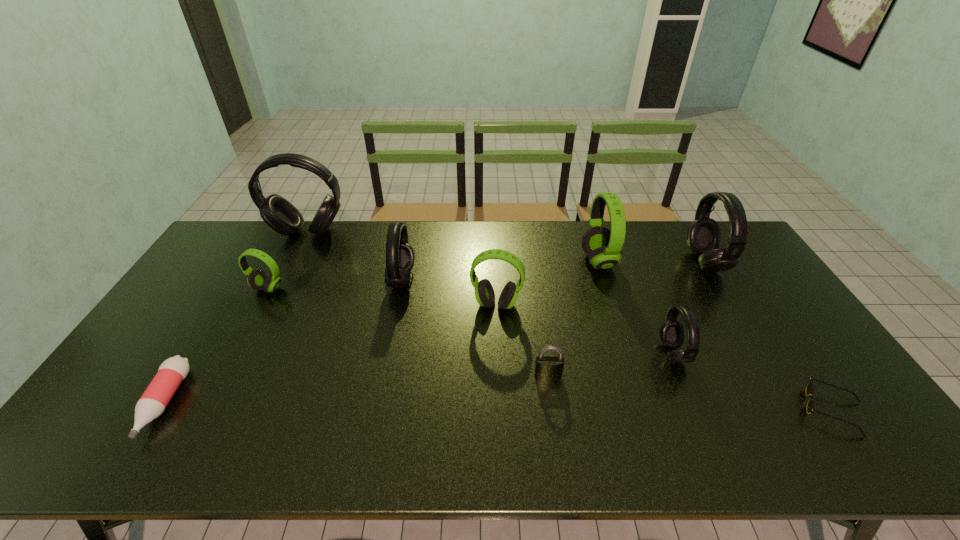
Identify which headset is located as the sixth nearest to the fifth headset from left to right. Please provide its 2D coordinates. Your answer should be formatted as a tuple, i.e. [(x, y)], where the tuple contains the x and y coordinates of a point satisfying the conditions above.

[(258, 280)]

Locate which gray headset is the third closest to the leftmost green headset. Please provide its 2D coordinates. Your answer should be formatted as a tuple, i.e. [(x, y)], where the tuple contains the x and y coordinates of a point satisfying the conditions above.

[(672, 333)]

In order to click on the third closest gray headset to the second gray headset from right to left in this screenshot , I will do `click(278, 213)`.

Identify the location of green headset that stands as the closest to the fourth headset from right to left. (603, 246).

Where is `green headset that stands as the second closest to the eighth object from left to right`? green headset that stands as the second closest to the eighth object from left to right is located at coordinates (484, 292).

Where is `vacant position in the image that satisfies the following two spatial constraints: 1. on the earcups of the sixth object from right to left; 2. on the right side of the leftmost gray headset`? The width and height of the screenshot is (960, 540). vacant position in the image that satisfies the following two spatial constraints: 1. on the earcups of the sixth object from right to left; 2. on the right side of the leftmost gray headset is located at coordinates (272, 305).